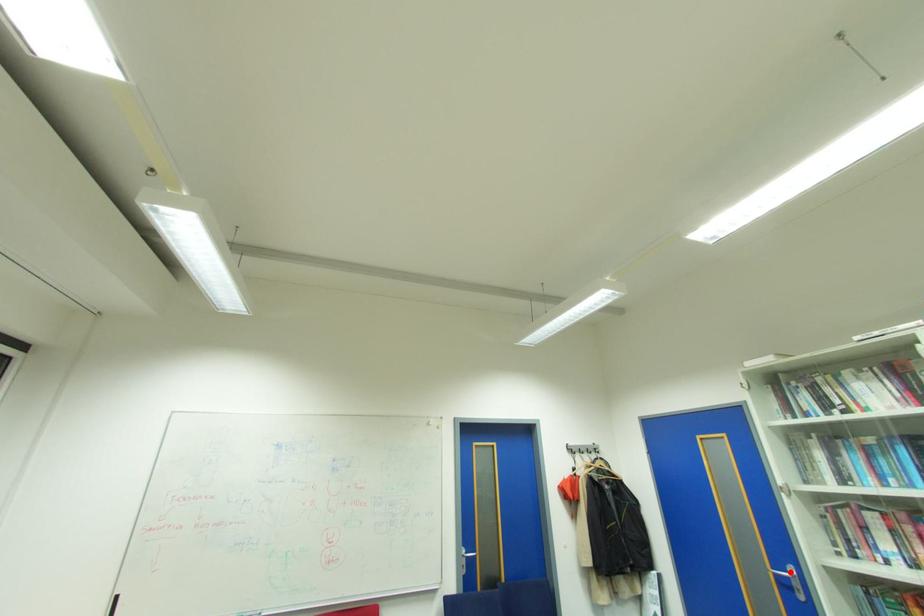
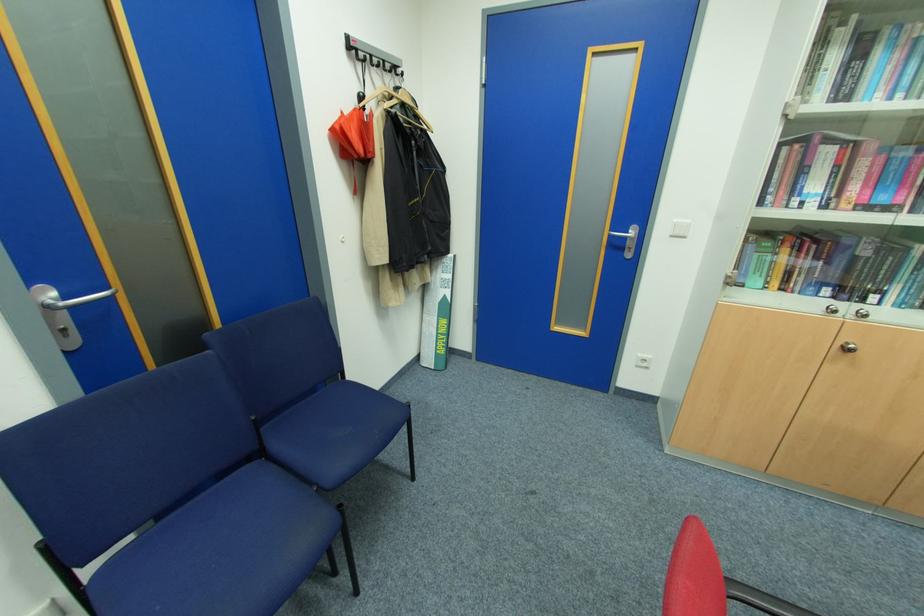
Question: I am providing you with two images of the same scene from different viewpoints. A red point is marked on the first image. Can you still see the location of the red point in image 2?

Choices:
 (A) Yes
 (B) No

Answer: (A)